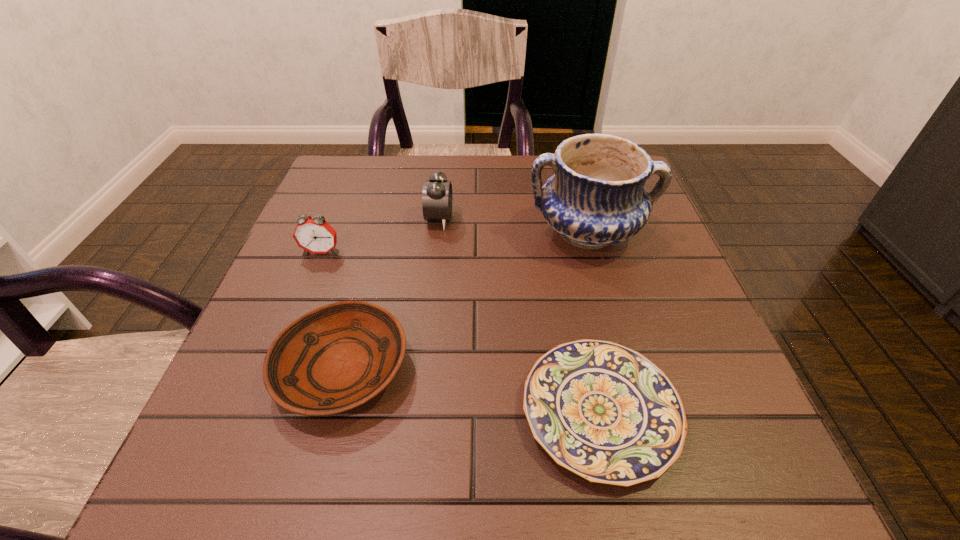
Locate an element on the screen. The height and width of the screenshot is (540, 960). empty space between the nearer alarm clock and the pottery is located at coordinates (454, 242).

Identify the location of vacant space in between the shorter plate and the second shortest object. click(471, 390).

The image size is (960, 540). In order to click on empty space that is in between the second shortest object and the tallest object in this screenshot , I will do click(465, 301).

Where is `free space between the shorter plate and the taller plate`? Image resolution: width=960 pixels, height=540 pixels. free space between the shorter plate and the taller plate is located at coordinates (471, 390).

Image resolution: width=960 pixels, height=540 pixels. Find the location of `object that is the second nearest to the right alarm clock`. object that is the second nearest to the right alarm clock is located at coordinates (314, 234).

At what (x,y) coordinates should I click in order to perform the action: click on object that is the third closest to the right alarm clock. Please return your answer as a coordinate pair (x, y). Looking at the image, I should click on (335, 358).

At what (x,y) coordinates should I click in order to perform the action: click on vacant position in the image that satisfies the following two spatial constraints: 1. on the front side of the tallest object; 2. on the left side of the farther alarm clock. Please return your answer as a coordinate pair (x, y). The width and height of the screenshot is (960, 540). Looking at the image, I should click on (438, 233).

The width and height of the screenshot is (960, 540). Identify the location of free region that satisfies the following two spatial constraints: 1. on the back side of the tallest object; 2. on the left side of the shortest object. (562, 233).

Where is `free space that satisfies the following two spatial constraints: 1. on the front side of the farther alarm clock; 2. on the clock face of the nearer alarm clock`? Image resolution: width=960 pixels, height=540 pixels. free space that satisfies the following two spatial constraints: 1. on the front side of the farther alarm clock; 2. on the clock face of the nearer alarm clock is located at coordinates (436, 252).

Identify the location of vacant space that satisfies the following two spatial constraints: 1. on the front side of the pottery; 2. on the right side of the farther alarm clock. This screenshot has width=960, height=540. (438, 233).